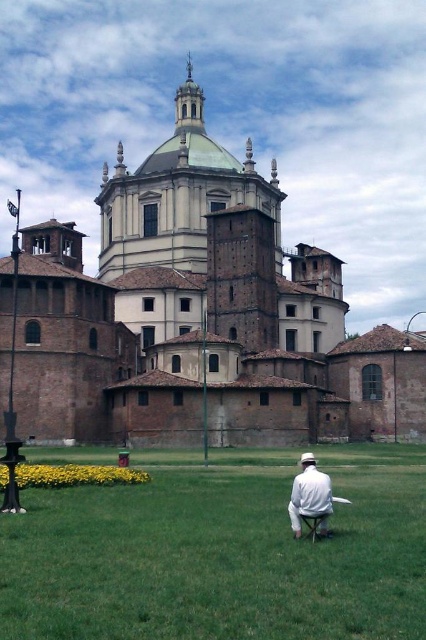
At what (x,y) coordinates should I click in order to perform the action: click on brown brick church at center. Please return your answer as a coordinate pair (x, y). The height and width of the screenshot is (640, 426). Looking at the image, I should click on (199, 316).

Is green grass at center to the left of white cotton shirt at center from the viewer's perspective?

Yes, green grass at center is to the left of white cotton shirt at center.

Is point (123, 556) positioned in front of point (328, 490)?

That is True.

Identify the location of green grass at center. The width and height of the screenshot is (426, 640). (221, 552).

Can you confirm if brown brick church at center is taller than green grass at center?

Indeed, brown brick church at center has a greater height compared to green grass at center.

Which is below, brown brick church at center or green grass at center?

green grass at center is lower down.

Find the location of `brown brick church at center`. brown brick church at center is located at coordinates (199, 316).